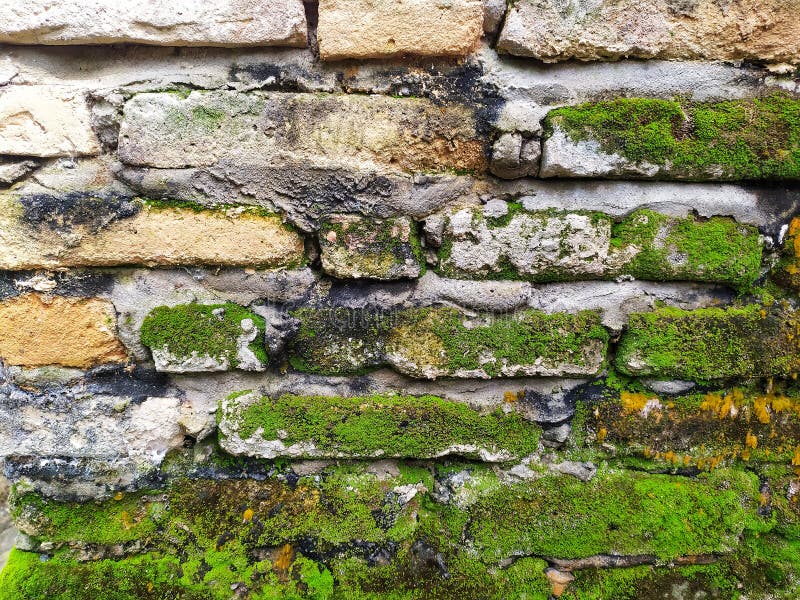
You are a GUI agent. You are given a task and a screenshot of the screen. Output one action in this format:
    pyautogui.click(x=<x>, y=<y>)
    Task: Click on the white brick
    This screenshot has width=800, height=600.
    Given the screenshot: What is the action you would take?
    pyautogui.click(x=354, y=24), pyautogui.click(x=160, y=15), pyautogui.click(x=598, y=83), pyautogui.click(x=20, y=119), pyautogui.click(x=261, y=152)